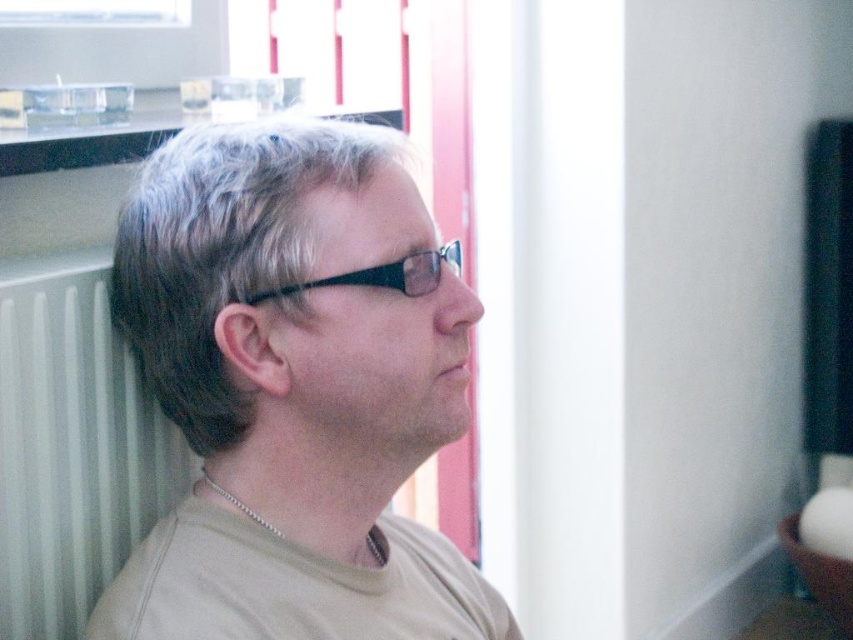
Question: Which of the following is the closest to the observer?

Choices:
 (A) gray matte hair at center
 (B) black plastic glasses at center

Answer: (B)

Question: Which object appears farthest from the camera in this image?

Choices:
 (A) silver chain at neck
 (B) gray matte hair at center
 (C) white matte radiator at left

Answer: (C)

Question: Where is gray matte hair at center located in relation to silver chain at neck in the image?

Choices:
 (A) right
 (B) left

Answer: (B)

Question: Can you confirm if gray matte hair at center is bigger than black plastic glasses at center?

Choices:
 (A) no
 (B) yes

Answer: (B)

Question: Which object is the farthest from the matte beige shirt at center?

Choices:
 (A) gray matte hair at center
 (B) white matte radiator at left
 (C) silver chain at neck
 (D) black plastic glasses at center

Answer: (B)

Question: Can you confirm if matte beige shirt at center is thinner than gray matte hair at center?

Choices:
 (A) no
 (B) yes

Answer: (A)